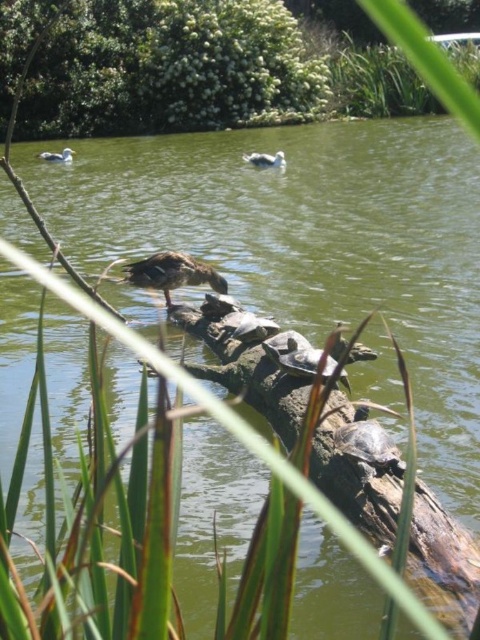
Question: Among these objects, which one is nearest to the camera?

Choices:
 (A) brown matte duck at center
 (B) green leafy bush at upper center
 (C) smooth brown turtle at center
 (D) smooth gray turtle at center

Answer: (C)

Question: Which of the following is the farthest from the observer?

Choices:
 (A) green leafy bush at upper center
 (B) smooth gray turtle at center
 (C) smooth brown turtle at center

Answer: (A)

Question: Can you confirm if green leafy bush at upper center is positioned below white matte duck at upper center?

Choices:
 (A) no
 (B) yes

Answer: (A)

Question: Among these points, which one is nearest to the camera?

Choices:
 (A) (326, 364)
 (B) (380, 445)
 (C) (165, 257)
 (D) (73, 150)

Answer: (B)

Question: Is the position of smooth gray turtle at center less distant than that of white matte duck at upper center?

Choices:
 (A) yes
 (B) no

Answer: (A)

Question: Does smooth gray turtle at center have a greater width compared to matte gray duck at upper left?

Choices:
 (A) no
 (B) yes

Answer: (A)